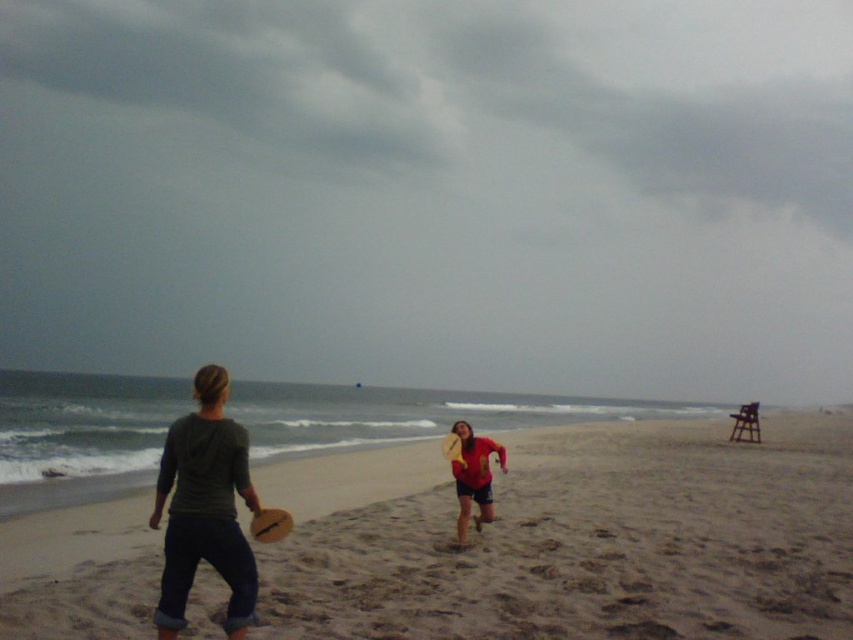
Based on the photo, between smooth sand at center and wooden frisbee at center, which one has less height?

With less height is wooden frisbee at center.

Can you confirm if smooth sand at center is positioned below wooden frisbee at center?

Yes.

The image size is (853, 640). I want to click on smooth sand at center, so click(x=595, y=545).

Locate an element on the screen. The image size is (853, 640). smooth sand at center is located at coordinates (595, 545).

Measure the distance between smooth sand at center and camera.

The distance of smooth sand at center from camera is 20.28 feet.

Does smooth sand at center appear on the right side of red matte shirt at center?

Indeed, smooth sand at center is positioned on the right side of red matte shirt at center.

Identify the location of smooth sand at center. This screenshot has width=853, height=640. (595, 545).

You are a GUI agent. You are given a task and a screenshot of the screen. Output one action in this format:
    pyautogui.click(x=<x>, y=<y>)
    Task: Click on the smooth sand at center
    
    Given the screenshot: What is the action you would take?
    pyautogui.click(x=595, y=545)

Can you confirm if dark gray hoodie at center is positioned above wooden frisbee at center?

Actually, dark gray hoodie at center is below wooden frisbee at center.

Is point (202, 432) less distant than point (265, 515)?

Yes, it is in front of point (265, 515).

Is point (210, 474) behind point (264, 540)?

No, (210, 474) is closer to viewer.

Image resolution: width=853 pixels, height=640 pixels. I want to click on dark gray hoodie at center, so click(x=206, y=508).